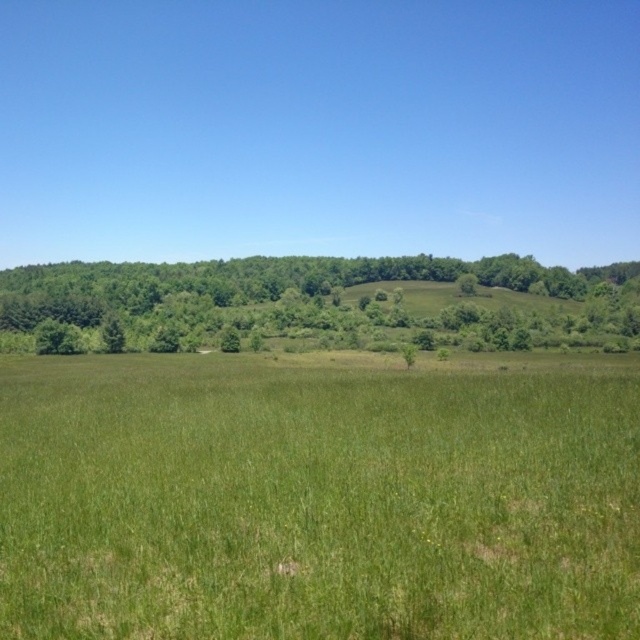
Question: Among these objects, which one is farthest from the camera?

Choices:
 (A) green grassy field at center
 (B) green leafy tree at upper center

Answer: (B)

Question: Does green grassy field at center have a greater width compared to green leafy tree at upper center?

Choices:
 (A) yes
 (B) no

Answer: (B)

Question: Can you confirm if green grassy field at center is positioned above green leafy tree at upper center?

Choices:
 (A) yes
 (B) no

Answer: (B)

Question: Is green grassy field at center above green leafy tree at upper center?

Choices:
 (A) yes
 (B) no

Answer: (B)